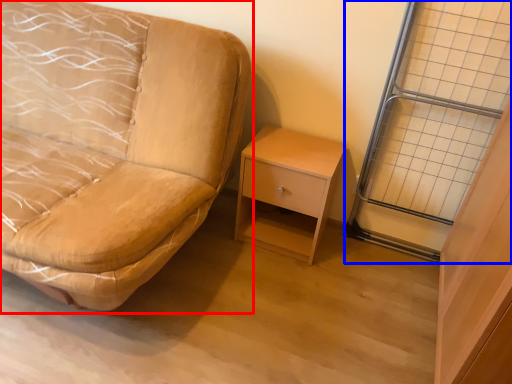
Question: Which point is further to the camera, studio couch (highlighted by a red box) or glass door (highlighted by a blue box)?

Choices:
 (A) studio couch
 (B) glass door

Answer: (B)